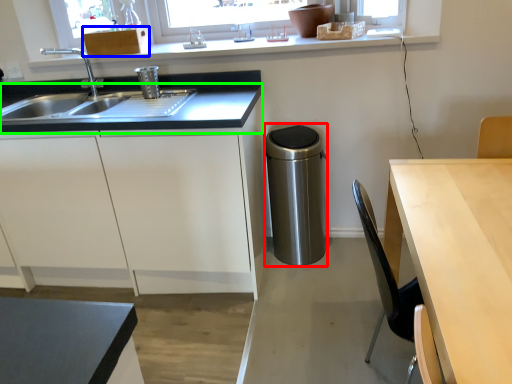
Question: Based on their relative distances, which object is farther from appliance (highlighted by a red box)? Choose from cabinetry (highlighted by a blue box) and countertop (highlighted by a green box).

Choices:
 (A) cabinetry
 (B) countertop

Answer: (A)